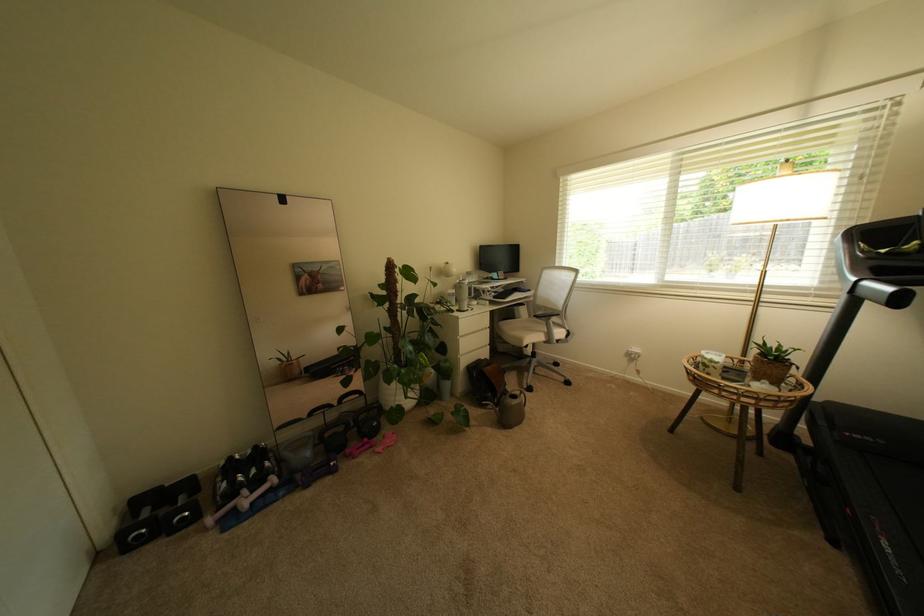
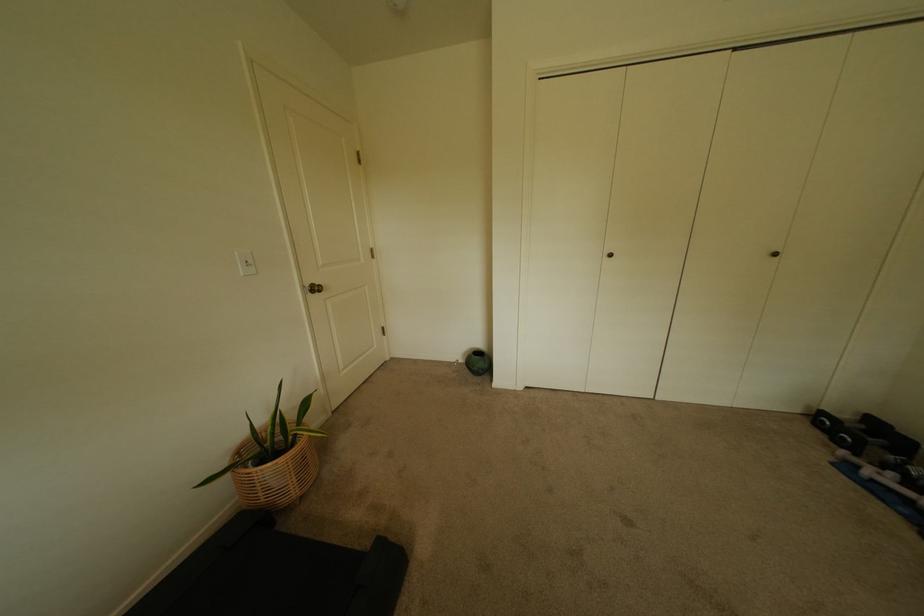
Where in the second image is the point corresponding to (130,535) from the first image?

(831, 415)